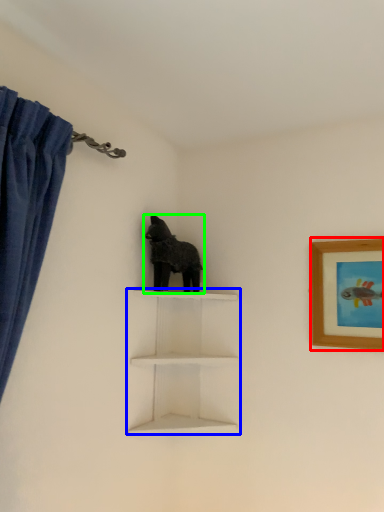
Question: Which object is the farthest from picture frame (highlighted by a red box)? Choose among these: shelf (highlighted by a blue box) or animal (highlighted by a green box).

Choices:
 (A) shelf
 (B) animal

Answer: (B)